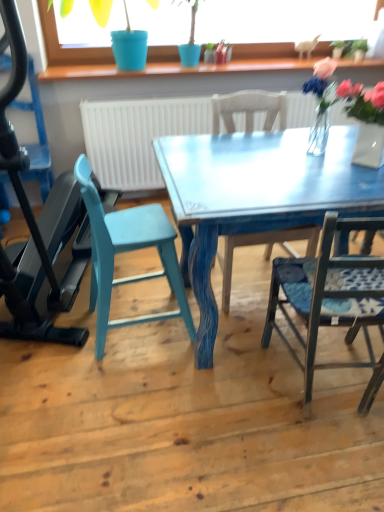
Describe the element at coordinates (249, 109) in the screenshot. I see `blue fabric chair at center, which appears as the third chair when viewed from the left` at that location.

This screenshot has width=384, height=512. What are the coordinates of `teal painted wood chair at left, which is the fourth chair in right-to-left order` in the screenshot? It's located at (38, 137).

Looking at this image, how much space does clear glass vase at upper right, the first floral arrangement positioned from the right, occupy horizontally?

clear glass vase at upper right, the first floral arrangement positioned from the right, is 25.36 centimeters in width.

Locate an element on the screen. metallic blue treadmill at left is located at coordinates (34, 219).

Describe the element at coordinates (321, 103) in the screenshot. I see `translucent glass vase at upper right, the second floral arrangement when ordered from right to left` at that location.

This screenshot has width=384, height=512. I want to click on blue fabric chair at center, which appears as the third chair when viewed from the left, so click(x=249, y=109).

Is clear glass vase at upper right, the first floral arrangement positioned from the right, looking in the opposite direction of green matte plant at upper right?

That's not correct — clear glass vase at upper right, the first floral arrangement positioned from the right, is not looking away from green matte plant at upper right.

Is the depth of clear glass vase at upper right, the first floral arrangement positioned from the right, greater than that of green matte plant at upper right?

No, clear glass vase at upper right, the first floral arrangement positioned from the right, is in front of green matte plant at upper right.

Which point is more distant from viewer, (372, 144) or (363, 48)?

The point (363, 48) is more distant.

Is clear glass vase at upper right, the second floral arrangement when ordered from left to right, bigger or smaller than green matte plant at upper right?

Considering their sizes, clear glass vase at upper right, the second floral arrangement when ordered from left to right, takes up more space than green matte plant at upper right.

Can you confirm if blue fabric chair at center, which appears as the third chair when viewed from the left, is positioned to the left of translucent glass vase at upper right, the 1th floral arrangement in the left-to-right sequence?

Yes, blue fabric chair at center, which appears as the third chair when viewed from the left, is to the left of translucent glass vase at upper right, the 1th floral arrangement in the left-to-right sequence.

Based on the photo, does blue fabric chair at center, the 2th chair viewed from the right, have a greater width compared to translucent glass vase at upper right, the second floral arrangement when ordered from right to left?

Yes, blue fabric chair at center, the 2th chair viewed from the right, is wider than translucent glass vase at upper right, the second floral arrangement when ordered from right to left.

From the image's perspective, is blue fabric chair at center, which appears as the third chair when viewed from the left, located above or below translucent glass vase at upper right, the 1th floral arrangement in the left-to-right sequence?

blue fabric chair at center, which appears as the third chair when viewed from the left, is below translucent glass vase at upper right, the 1th floral arrangement in the left-to-right sequence.

Is blue fabric chair at center, which appears as the third chair when viewed from the left, positioned beyond the bounds of translucent glass vase at upper right, the 1th floral arrangement in the left-to-right sequence?

Yes, blue fabric chair at center, which appears as the third chair when viewed from the left, is not within translucent glass vase at upper right, the 1th floral arrangement in the left-to-right sequence.

There is a blue fabric chair at center, which appears as the third chair when viewed from the left. At what (x,y) coordinates should I click in order to perform the action: click on the 2nd chair above it (from a real-world perspective). Please return your answer as a coordinate pair (x, y). The width and height of the screenshot is (384, 512). Looking at the image, I should click on (38, 137).

Considering the relative sizes of teal painted wood chair at left, which ranks as the first chair in left-to-right order, and blue fabric chair at center, which appears as the third chair when viewed from the left, in the image provided, is teal painted wood chair at left, which ranks as the first chair in left-to-right order, smaller than blue fabric chair at center, which appears as the third chair when viewed from the left,?

Indeed, teal painted wood chair at left, which ranks as the first chair in left-to-right order, has a smaller size compared to blue fabric chair at center, which appears as the third chair when viewed from the left.

How different are the orientations of teal painted wood chair at left, which is the fourth chair in right-to-left order, and blue fabric chair at center, which appears as the third chair when viewed from the left, in degrees?

They differ by 0.0419 degrees in their facing directions.

Between teal painted wood chair at left, which ranks as the first chair in left-to-right order, and blue fabric chair at center, the 2th chair viewed from the right, which one appears on the left side from the viewer's perspective?

From the viewer's perspective, teal painted wood chair at left, which ranks as the first chair in left-to-right order, appears more on the left side.

From a real-world perspective, relative to blue plastic pot at upper center, is translucent glass vase at upper right, the 1th floral arrangement in the left-to-right sequence, vertically above or below?

From a real-world perspective, translucent glass vase at upper right, the 1th floral arrangement in the left-to-right sequence, is physically below blue plastic pot at upper center.

How much distance is there between translucent glass vase at upper right, the second floral arrangement when ordered from right to left, and blue plastic pot at upper center?

1.69 meters.

Does point (324, 120) appear closer or farther from the camera than point (47, 7)?

Point (324, 120).

Do you think translucent glass vase at upper right, the 1th floral arrangement in the left-to-right sequence, is within blue plastic pot at upper center, or outside of it?

translucent glass vase at upper right, the 1th floral arrangement in the left-to-right sequence, is outside blue plastic pot at upper center.

From the picture: Is clear glass vase at upper right, the second floral arrangement when ordered from left to right, at the back of green matte plant at upper right?

green matte plant at upper right is not turned away from clear glass vase at upper right, the second floral arrangement when ordered from left to right.

From a real-world perspective, is green matte plant at upper right beneath clear glass vase at upper right, the second floral arrangement when ordered from left to right?

No.

Does green matte plant at upper right have a lesser width compared to clear glass vase at upper right, the first floral arrangement positioned from the right?

Indeed, green matte plant at upper right has a lesser width compared to clear glass vase at upper right, the first floral arrangement positioned from the right.

Can you confirm if green matte plant at upper right is positioned to the right of blue plastic pot at upper center?

Yes, green matte plant at upper right is to the right of blue plastic pot at upper center.

Can blue plastic pot at upper center be found inside green matte plant at upper right?

No.

Considering the sizes of objects green matte plant at upper right and blue plastic pot at upper center in the image provided, who is wider, green matte plant at upper right or blue plastic pot at upper center?

With larger width is blue plastic pot at upper center.

Is green matte plant at upper right not close to blue plastic pot at upper center?

Yes, green matte plant at upper right and blue plastic pot at upper center are quite far apart.

Looking at this image, from a real-world perspective, is blue plastic pot at upper center positioned above or below blue fabric chair at center, which appears as the third chair when viewed from the left?

From a real-world perspective, blue plastic pot at upper center is physically above blue fabric chair at center, which appears as the third chair when viewed from the left.

The image size is (384, 512). Identify the location of the 3rd chair located beneath the blue plastic pot at upper center (from a real-world perspective). (249, 109).

From the image's perspective, relative to blue fabric chair at center, the 2th chair viewed from the right, is blue plastic pot at upper center above or below?

blue plastic pot at upper center is situated higher than blue fabric chair at center, the 2th chair viewed from the right, in the image.

Does point (72, 62) come farther from viewer compared to point (217, 118)?

Yes, it is.

Where is `plant above the clear glass vase at upper right, the first floral arrangement positioned from the right (from the image's perspective)`? plant above the clear glass vase at upper right, the first floral arrangement positioned from the right (from the image's perspective) is located at coordinates (356, 48).

Find the location of `the 1st chair to the left when counting from the translucent glass vase at upper right, the 1th floral arrangement in the left-to-right sequence`. the 1st chair to the left when counting from the translucent glass vase at upper right, the 1th floral arrangement in the left-to-right sequence is located at coordinates (249, 109).

From the image, which object appears to be farther from blue plastic pot at upper center, translucent glass vase at upper right, the second floral arrangement when ordered from right to left, or green matte plant at upper right?

The object further to blue plastic pot at upper center is green matte plant at upper right.

When comparing their distances from metallic blue treadmill at left, does translucent glass vase at upper right, the 1th floral arrangement in the left-to-right sequence, or blue fabric chair at center, which appears as the third chair when viewed from the left, seem closer?

Based on the image, blue fabric chair at center, which appears as the third chair when viewed from the left, appears to be nearer to metallic blue treadmill at left.

Considering their positions, is green matte plant at upper right positioned closer to metallic blue chair at right, which is the 1th chair in right-to-left order, than translucent glass vase at upper right, the 1th floral arrangement in the left-to-right sequence?

translucent glass vase at upper right, the 1th floral arrangement in the left-to-right sequence.

Considering their positions, is teal painted wood chair at lower left, positioned as the 3th chair in right-to-left order, positioned further to metallic blue chair at right, which is the 1th chair in right-to-left order, than teal painted wood chair at left, which ranks as the first chair in left-to-right order?

teal painted wood chair at left, which ranks as the first chair in left-to-right order, lies further to metallic blue chair at right, which is the 1th chair in right-to-left order, than the other object.

Estimate the real-world distances between objects in this image. Which object is closer to metallic blue chair at right, the 4th chair in the left-to-right sequence, teal painted wood chair at lower left, which appears as the second chair when viewed from the left, or blue fabric chair at center, which appears as the third chair when viewed from the left?

blue fabric chair at center, which appears as the third chair when viewed from the left, is closer to metallic blue chair at right, the 4th chair in the left-to-right sequence.

Considering their positions, is metallic blue treadmill at left positioned closer to blue fabric chair at center, the 2th chair viewed from the right, than translucent glass vase at upper right, the 1th floral arrangement in the left-to-right sequence?

translucent glass vase at upper right, the 1th floral arrangement in the left-to-right sequence, is positioned closer to the anchor blue fabric chair at center, the 2th chair viewed from the right.

From the image, which object appears to be farther from blue fabric chair at center, the 2th chair viewed from the right, green matte plant at upper right or metallic blue treadmill at left?

The object further to blue fabric chair at center, the 2th chair viewed from the right, is green matte plant at upper right.

When comparing their distances from clear glass vase at upper right, the first floral arrangement positioned from the right, does teal painted wood chair at left, which is the fourth chair in right-to-left order, or metallic blue treadmill at left seem closer?

metallic blue treadmill at left is closer to clear glass vase at upper right, the first floral arrangement positioned from the right.

Identify the location of floral arrangement located between teal painted wood chair at left, which is the fourth chair in right-to-left order, and metallic blue chair at right, which is the 1th chair in right-to-left order, in the left-right direction. Image resolution: width=384 pixels, height=512 pixels. (321, 103).

Find the location of a particular element. Image resolution: width=384 pixels, height=512 pixels. chair located between teal painted wood chair at lower left, positioned as the 3th chair in right-to-left order, and metallic blue chair at right, the 4th chair in the left-to-right sequence, in the left-right direction is located at coordinates (249, 109).

Image resolution: width=384 pixels, height=512 pixels. What are the coordinates of `chair between teal painted wood chair at lower left, which appears as the second chair when viewed from the left, and translucent glass vase at upper right, the 1th floral arrangement in the left-to-right sequence` in the screenshot? It's located at (249, 109).

In order to click on houseplant situated between teal painted wood chair at left, which is the fourth chair in right-to-left order, and green matte plant at upper right from left to right in this screenshot , I will do [68, 48].